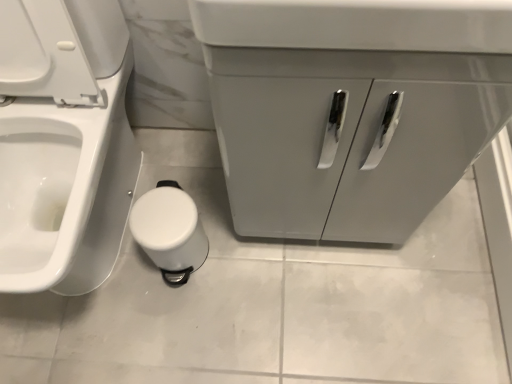
This screenshot has height=384, width=512. Find the location of `free space in front of matte gray cabinet at center`. free space in front of matte gray cabinet at center is located at coordinates (330, 312).